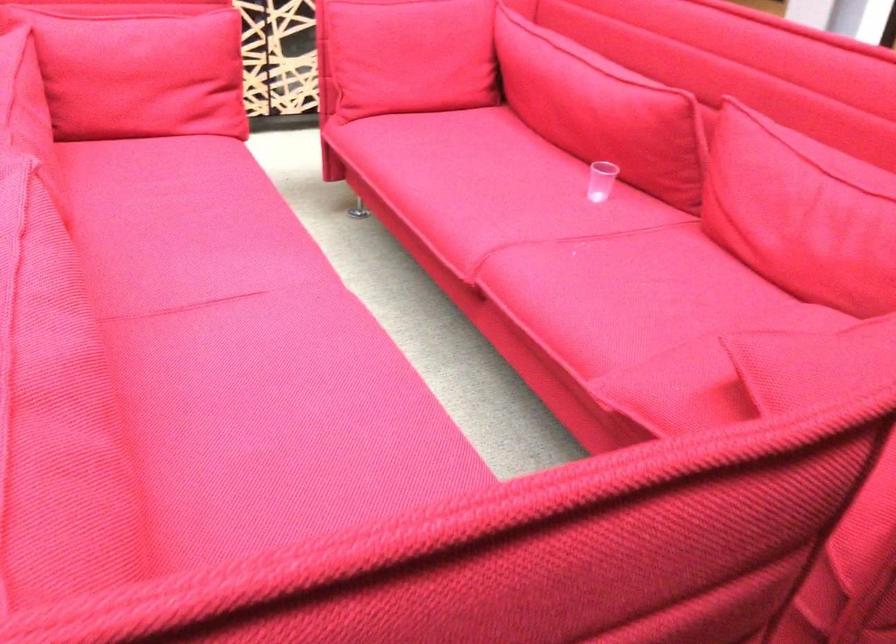
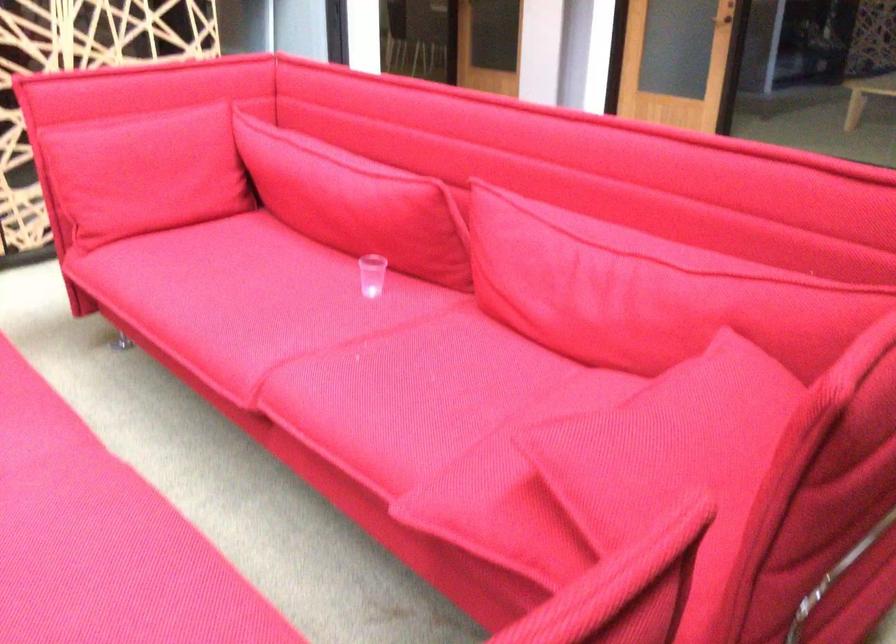
The images are taken continuously from a first-person perspective. In which direction are you moving?

The cameraman moved toward right, forward.